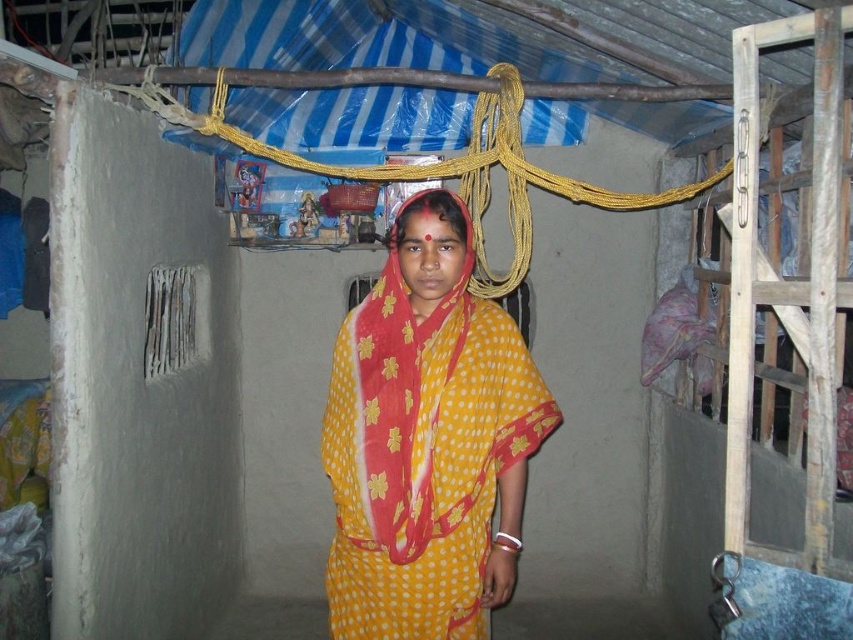
Question: Can you confirm if yellow dotted fabric at center is positioned below yellow dotted saree at center?

Choices:
 (A) yes
 (B) no

Answer: (A)

Question: Which point is closer to the camera?

Choices:
 (A) yellow dotted saree at center
 (B) yellow dotted fabric at center

Answer: (A)

Question: Can you confirm if yellow dotted fabric at center is positioned to the left of yellow dotted saree at center?

Choices:
 (A) no
 (B) yes

Answer: (A)

Question: Can you confirm if yellow dotted fabric at center is thinner than yellow dotted saree at center?

Choices:
 (A) no
 (B) yes

Answer: (A)